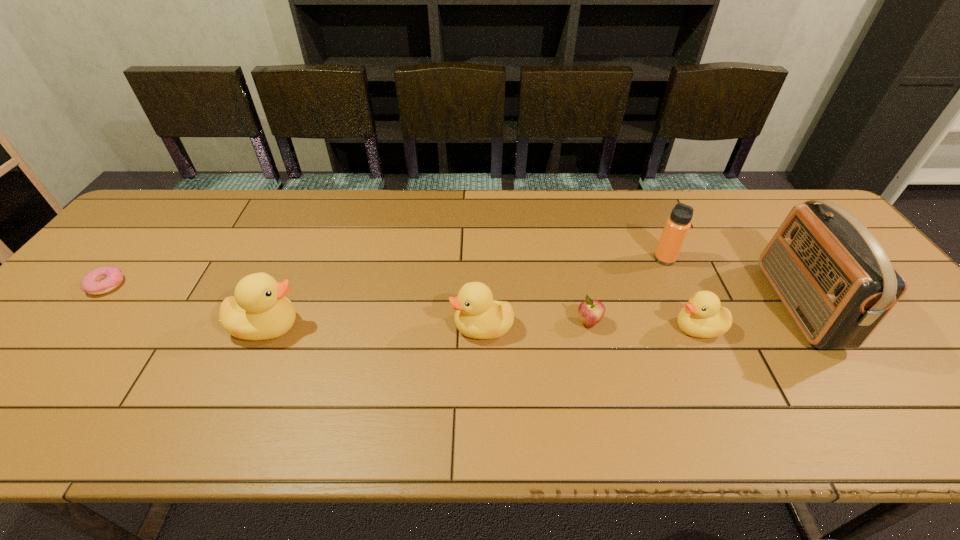
All ducklings are currently evenly spaced. To continue this pattern, where would you add another duckling on the right? Please point out a vacant spot. Please provide its 2D coordinates. Your answer should be formatted as a tuple, i.e. [(x, y)], where the tuple contains the x and y coordinates of a point satisfying the conditions above.

[(915, 329)]